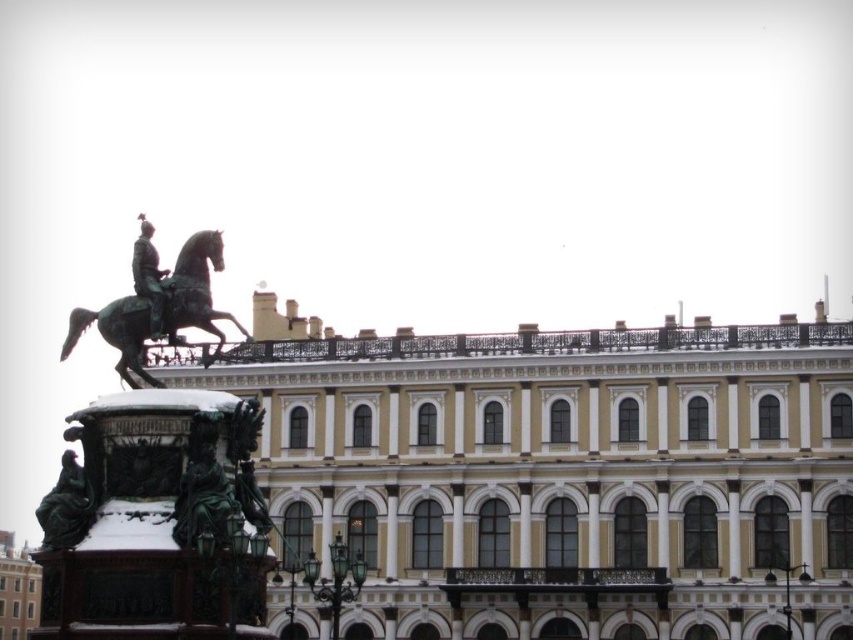
Question: Which of the following is the farthest from the observer?

Choices:
 (A) (68, 509)
 (B) (86, 324)
 (C) (138, 227)
 (D) (577, 630)

Answer: (C)

Question: Does bronze/golden horse at left appear under green patina statue at lower left?

Choices:
 (A) no
 (B) yes

Answer: (A)

Question: Considering the relative positions of bronze/golden horse at left and green patina statue at upper center in the image provided, where is bronze/golden horse at left located with respect to green patina statue at upper center?

Choices:
 (A) below
 (B) above

Answer: (A)

Question: Is green patina statue at lower left in front of green patina statue at upper center?

Choices:
 (A) yes
 (B) no

Answer: (A)

Question: Which point is farther from the camera taking this photo?

Choices:
 (A) (415, 349)
 (B) (160, 292)
 (C) (207, 259)

Answer: (A)

Question: Which object is positioned closest to the green patina statue at upper center?

Choices:
 (A) bronze/golden horse at left
 (B) golden stone palace at center

Answer: (A)